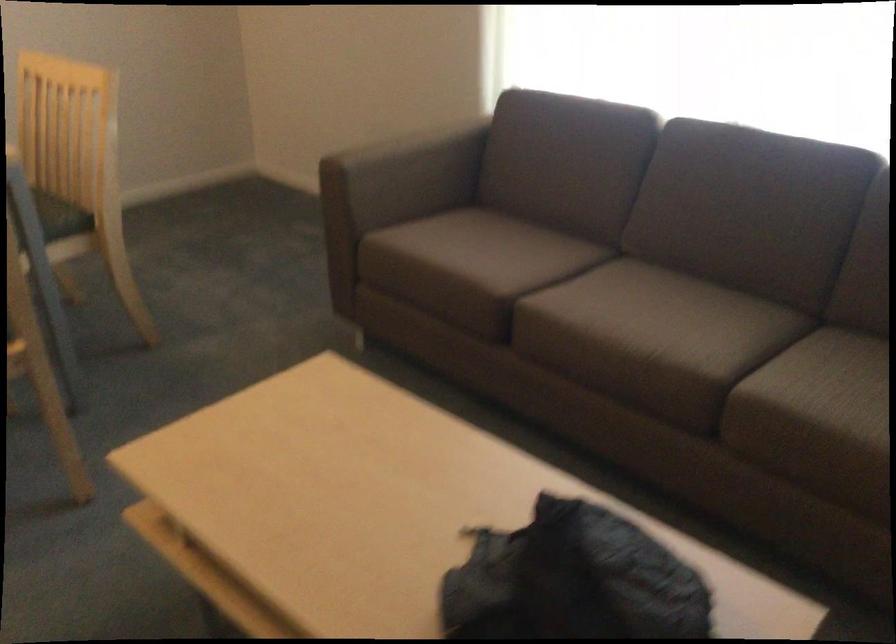
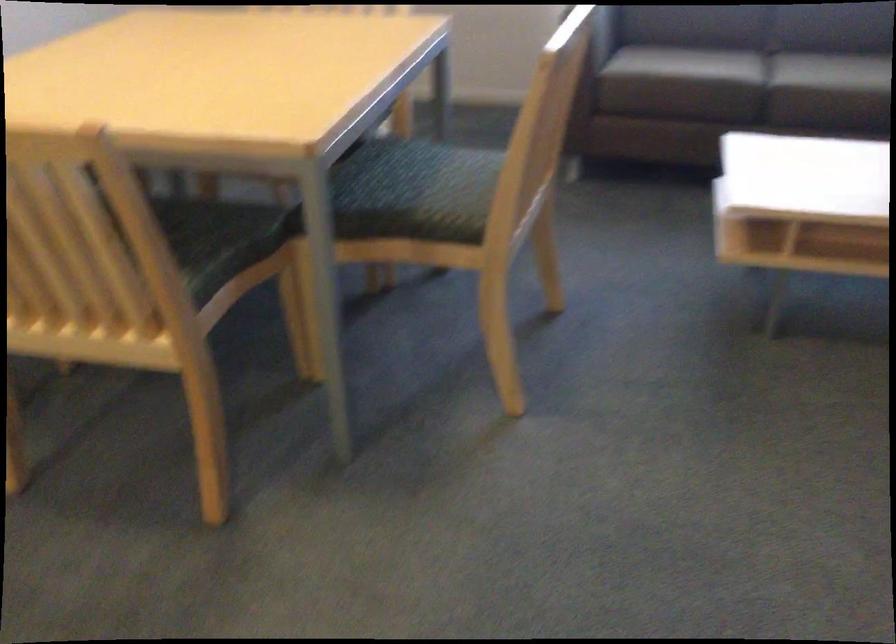
Question: In a continuous first-person perspective shot, in which direction is the camera moving?

Choices:
 (A) Left
 (B) Right
 (C) Forward
 (D) Backward

Answer: (A)